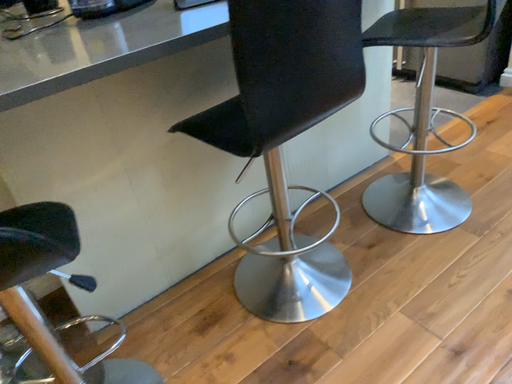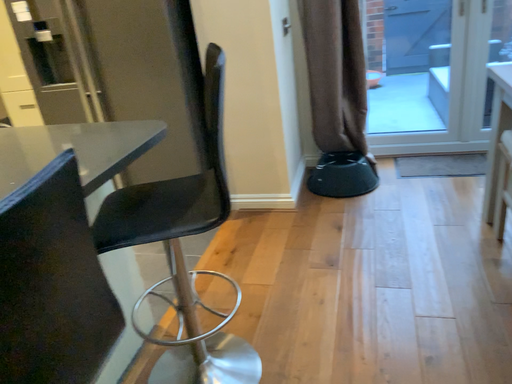
Question: How did the camera likely rotate when shooting the video?

Choices:
 (A) rotated downward
 (B) rotated upward

Answer: (B)